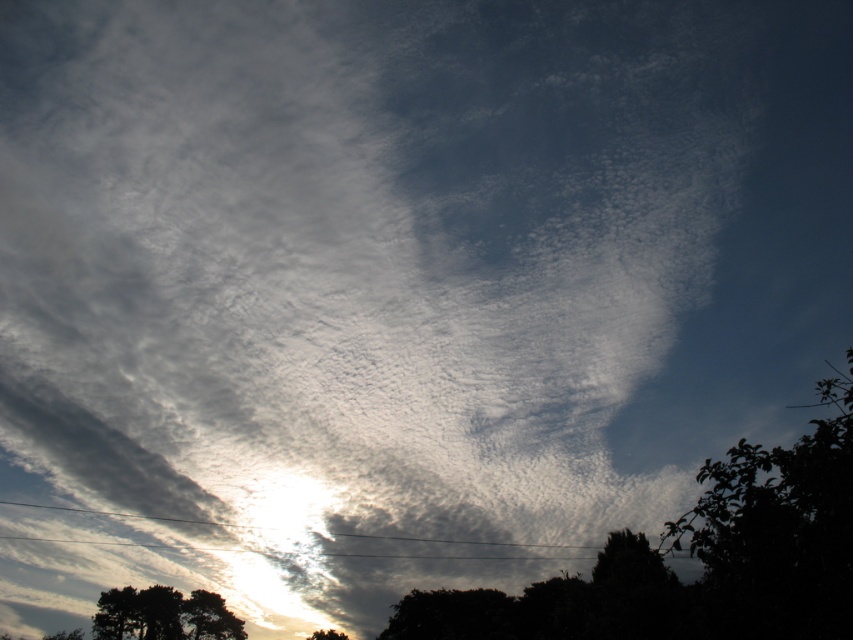
Where is `green leafy tree at lower left`? The height and width of the screenshot is (640, 853). green leafy tree at lower left is located at coordinates (210, 616).

Identify the location of green leafy tree at lower left. The width and height of the screenshot is (853, 640). (210, 616).

Who is higher up, dark green leafy tree at lower center or green leafy tree at lower left?

dark green leafy tree at lower center is above.

Consider the image. Between dark green leafy tree at lower center and green leafy tree at lower left, which one appears on the left side from the viewer's perspective?

From the viewer's perspective, green leafy tree at lower left appears more on the left side.

The height and width of the screenshot is (640, 853). I want to click on dark green leafy tree at lower center, so click(451, 616).

Is green leafy tree at lower right wider than green leafy tree at lower center?

Yes, green leafy tree at lower right is wider than green leafy tree at lower center.

Does point (763, 612) come in front of point (318, 632)?

Yes.

The height and width of the screenshot is (640, 853). Find the location of `green leafy tree at lower right`. green leafy tree at lower right is located at coordinates (776, 532).